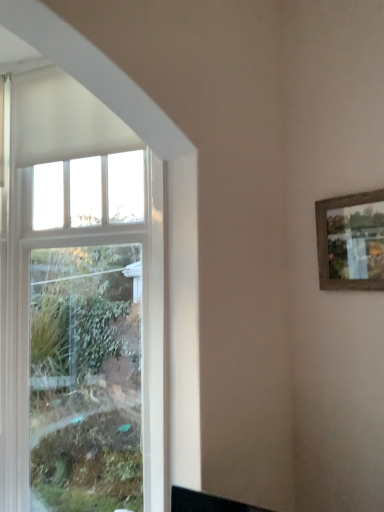
Question: From the image's perspective, is white glass window at left under wooden-framed picture at upper right?

Choices:
 (A) no
 (B) yes

Answer: (B)

Question: From the image's perspective, is white glass window at left located above wooden-framed picture at upper right?

Choices:
 (A) no
 (B) yes

Answer: (A)

Question: Does white glass window at left lie in front of wooden-framed picture at upper right?

Choices:
 (A) yes
 (B) no

Answer: (B)

Question: Is white glass window at left looking in the opposite direction of wooden-framed picture at upper right?

Choices:
 (A) yes
 (B) no

Answer: (B)

Question: Does white glass window at left have a smaller size compared to wooden-framed picture at upper right?

Choices:
 (A) no
 (B) yes

Answer: (A)

Question: Is white glass window at left taller than wooden-framed picture at upper right?

Choices:
 (A) yes
 (B) no

Answer: (A)

Question: Can you confirm if wooden-framed picture at upper right is shorter than white glass window at left?

Choices:
 (A) yes
 (B) no

Answer: (A)

Question: From the image's perspective, is wooden-framed picture at upper right located beneath white glass window at left?

Choices:
 (A) no
 (B) yes

Answer: (A)

Question: Is wooden-framed picture at upper right wider than white glass window at left?

Choices:
 (A) yes
 (B) no

Answer: (B)

Question: From a real-world perspective, is wooden-framed picture at upper right on top of white glass window at left?

Choices:
 (A) no
 (B) yes

Answer: (B)

Question: Could you tell me if wooden-framed picture at upper right is turned towards white glass window at left?

Choices:
 (A) no
 (B) yes

Answer: (A)

Question: Is the position of wooden-framed picture at upper right less distant than that of white glass window at left?

Choices:
 (A) no
 (B) yes

Answer: (B)

Question: Does point (319, 234) appear closer or farther from the camera than point (87, 254)?

Choices:
 (A) closer
 (B) farther

Answer: (A)